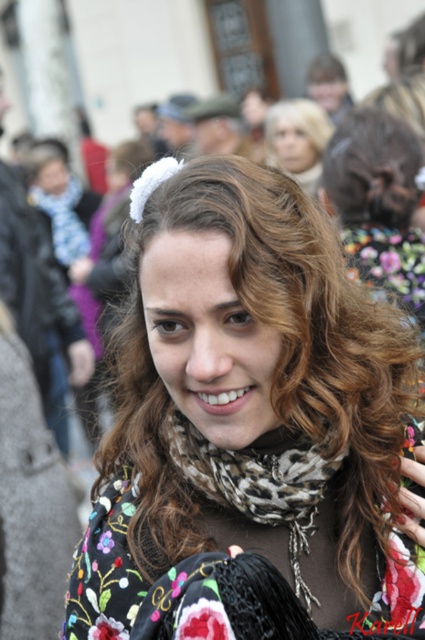
Identify the location of floral fabric shawl at center. This screenshot has width=425, height=640. (206, 552).

Is point (180, 465) more distant than point (257, 444)?

Yes.

Between point (297, 618) and point (229, 502), which one is positioned in front?

Point (297, 618)

This screenshot has height=640, width=425. I want to click on floral-patterned scarf at center, so click(249, 426).

Can you confirm if floral-patterned scarf at center is taller than floral fabric shawl at center?

Indeed, floral-patterned scarf at center has a greater height compared to floral fabric shawl at center.

Can you confirm if floral-patterned scarf at center is wider than floral fabric shawl at center?

Yes.

Which is in front, point (311, 284) or point (257, 525)?

Positioned in front is point (311, 284).

What are the coordinates of `floral-patterned scarf at center` in the screenshot? It's located at click(x=249, y=426).